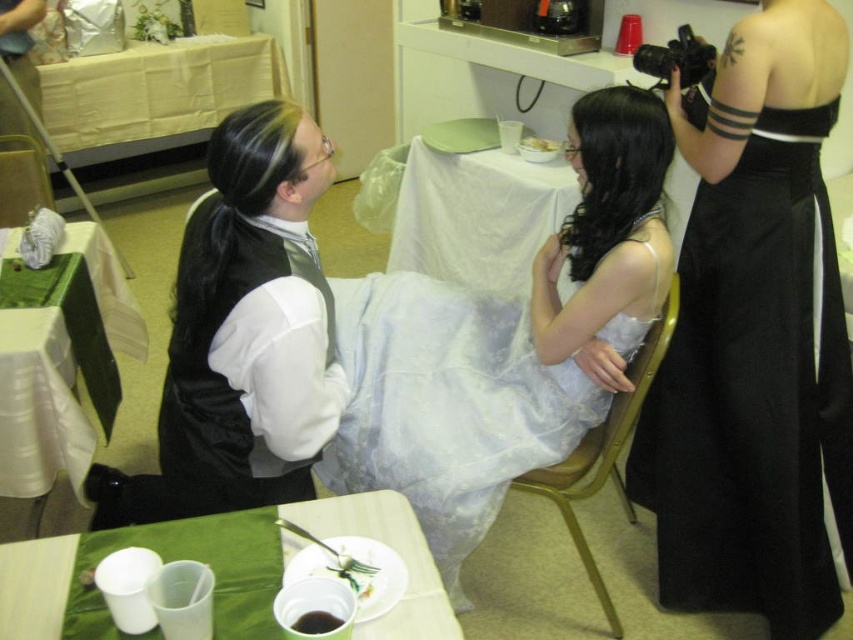
You are a photographer at a wedding reception. You need to take a photo of the black satin dress at right and the white lace dress at center. The camera you are using has a minimum focus distance of 16 inches. Can both dresses be in focus in the same shot?

The distance between the black satin dress at right and the white lace dress at center is 17.16 inches. Since the camera requires a minimum focus distance of 16 inches, both dresses can be in focus as the distance is within the camera capability.

What is the color of the dress located at the coordinates point (753, 394)?

The dress at point (753, 394) is black satin.

You are a photographer standing at the entrance of the reception area. You need to position yourself to capture a closeup shot of both the velvet black vest at left and the metallic gold chair at center without moving either object. Can you fit both subjects into your camera frame if your camera has a maximum field of view that can cover 30 inches? Explain your reasoning.

The velvet black vest at left is 28.89 inches away from the metallic gold chair at center. Since the distance between them is less than the camera frame maximum field of view of 30 inches, the photographer can fit both subjects into the frame by positioning themselves appropriately.